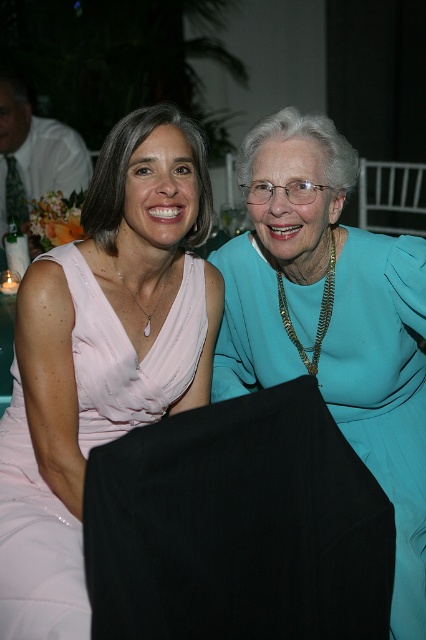
Which is above, teal satin dress at center or satin pink dress at center?

Positioned higher is satin pink dress at center.

Is point (236, 317) positioned before point (97, 365)?

No.

What do you see at coordinates (383, 392) in the screenshot? This screenshot has width=426, height=640. I see `teal satin dress at center` at bounding box center [383, 392].

Find the location of a particular element. Image resolution: width=426 pixels, height=640 pixels. teal satin dress at center is located at coordinates (383, 392).